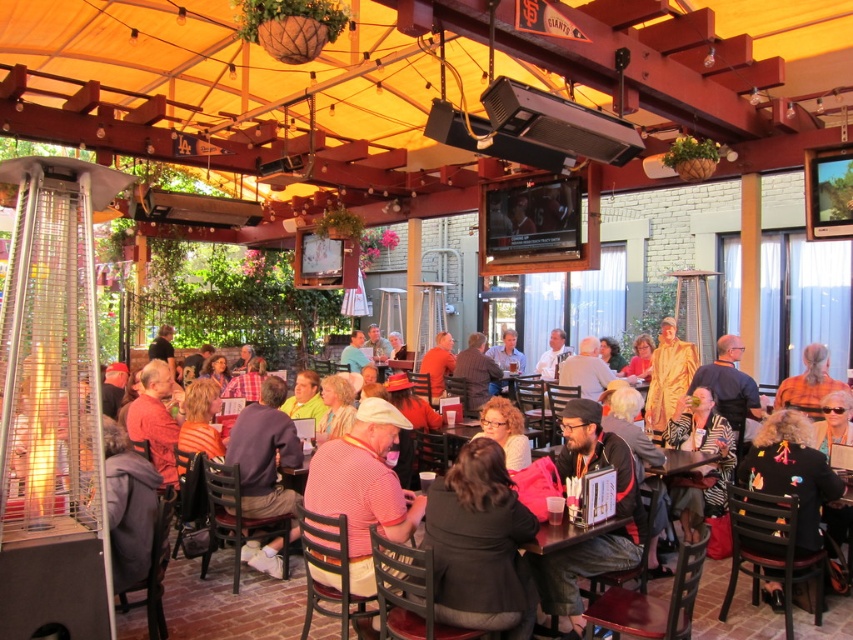
Can you confirm if dark gray sweater at center is taller than orange shirt at center?

Yes, dark gray sweater at center is taller than orange shirt at center.

Describe the element at coordinates (480, 545) in the screenshot. I see `dark gray sweater at center` at that location.

Is point (437, 604) farther from viewer compared to point (830, 387)?

No, (437, 604) is closer to viewer.

Identify the location of dark gray sweater at center. (480, 545).

Can you confirm if black fuzzy coat at lower right is thinner than orange shirt at center?

Incorrect, black fuzzy coat at lower right's width is not less than orange shirt at center's.

Does point (804, 532) come in front of point (822, 392)?

That is True.

Where is `black fuzzy coat at lower right`? black fuzzy coat at lower right is located at coordinates (791, 472).

The height and width of the screenshot is (640, 853). What do you see at coordinates (480, 545) in the screenshot? I see `dark gray sweater at center` at bounding box center [480, 545].

From the picture: Can you confirm if dark gray sweater at center is bigger than black fuzzy coat at lower right?

No, dark gray sweater at center is not bigger than black fuzzy coat at lower right.

Is point (474, 461) closer to camera compared to point (805, 500)?

Yes.

What are the coordinates of `dark gray sweater at center` in the screenshot? It's located at (480, 545).